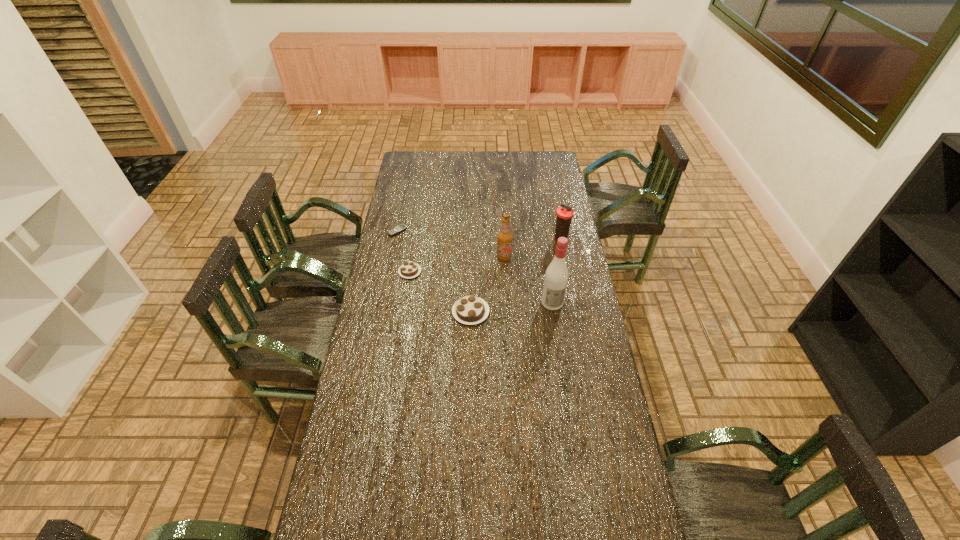
Locate an element on the screen. free space for a new chocolate cake on the right is located at coordinates [x=543, y=361].